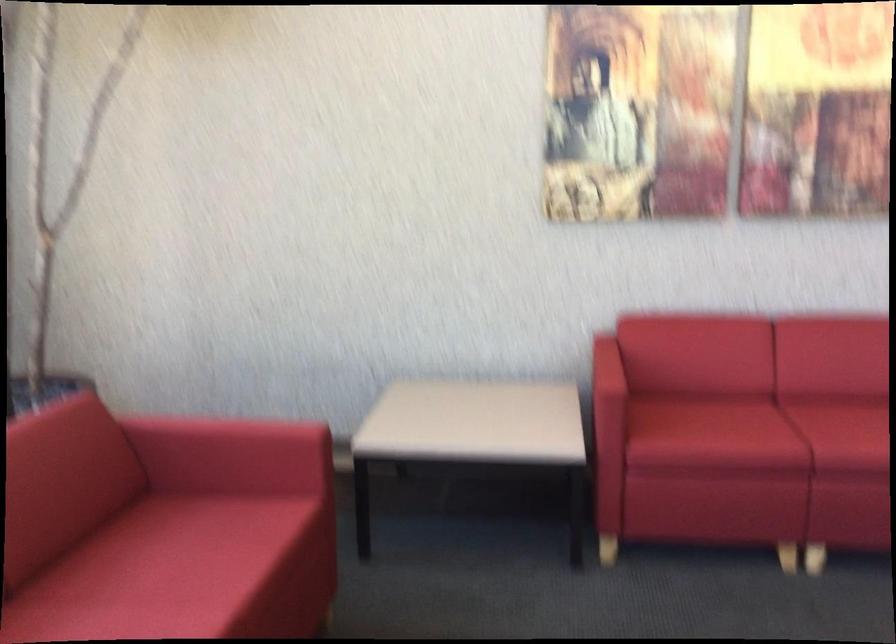
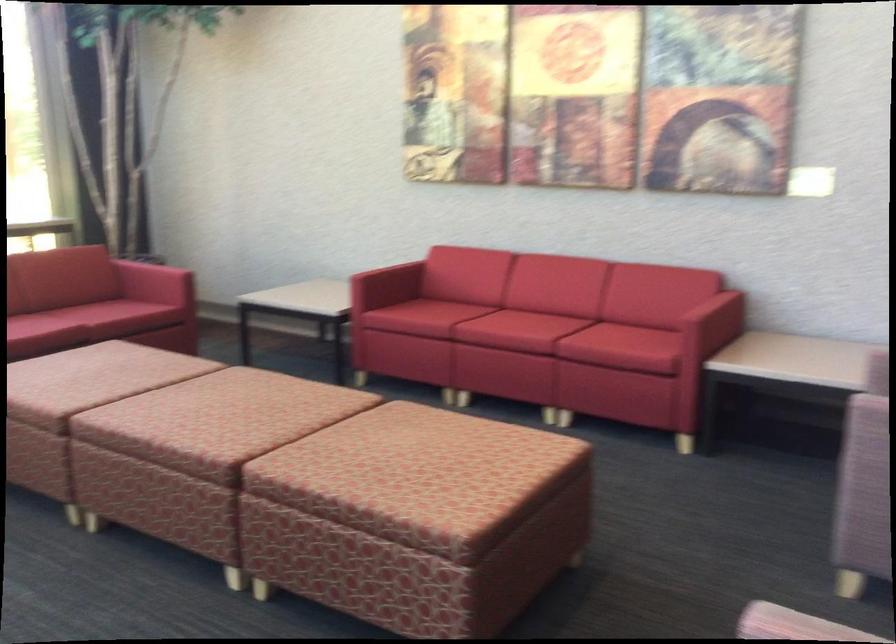
The images are taken continuously from a first-person perspective. In which direction are you moving?

The cameraman moved toward right, backward.